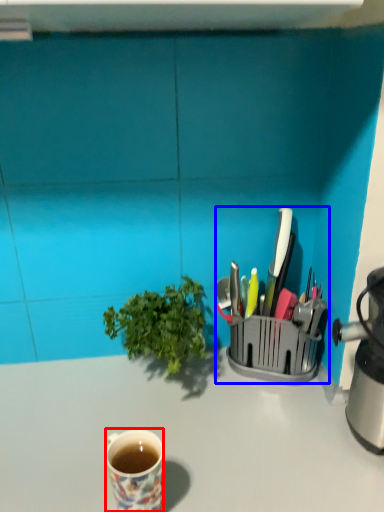
Question: Which object appears closest to the camera in this image, coffee cup (highlighted by a red box) or appliance (highlighted by a blue box)?

Choices:
 (A) coffee cup
 (B) appliance

Answer: (A)